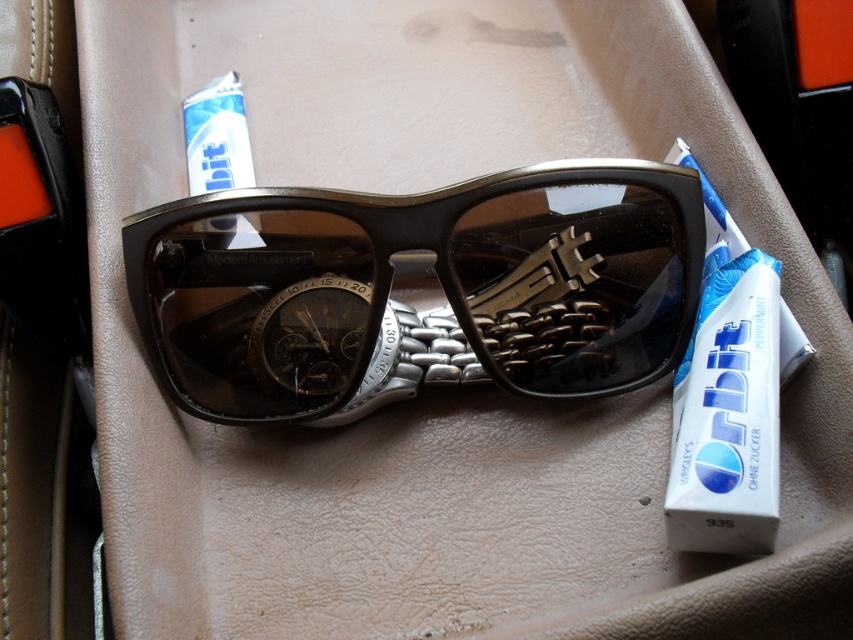
Question: Which point is farther to the camera?

Choices:
 (A) (744, 493)
 (B) (236, 232)

Answer: (B)

Question: Is white glossy toothpaste at right bigger than white glossy tube at upper center?

Choices:
 (A) no
 (B) yes

Answer: (B)

Question: Is matte black sunglasses at center bigger than white glossy toothpaste at right?

Choices:
 (A) yes
 (B) no

Answer: (A)

Question: Estimate the real-world distances between objects in this image. Which object is closer to the white glossy toothpaste at right?

Choices:
 (A) white glossy tube at upper center
 (B) matte black sunglasses at center

Answer: (B)

Question: Is matte black sunglasses at center thinner than white glossy toothpaste at right?

Choices:
 (A) no
 (B) yes

Answer: (A)

Question: Among these points, which one is nearest to the camera?

Choices:
 (A) (752, 538)
 (B) (200, 188)

Answer: (A)